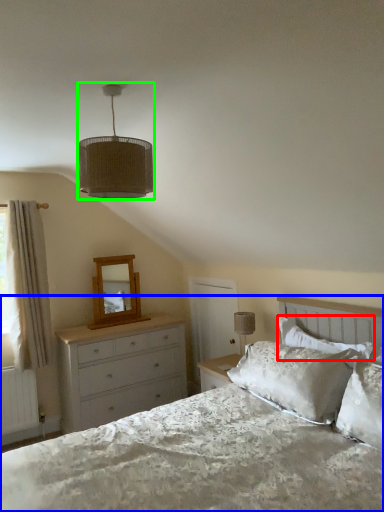
Question: Which object is positioned farthest from pillow (highlighted by a red box)? Select from bed (highlighted by a blue box) and lamp (highlighted by a green box).

Choices:
 (A) bed
 (B) lamp

Answer: (B)